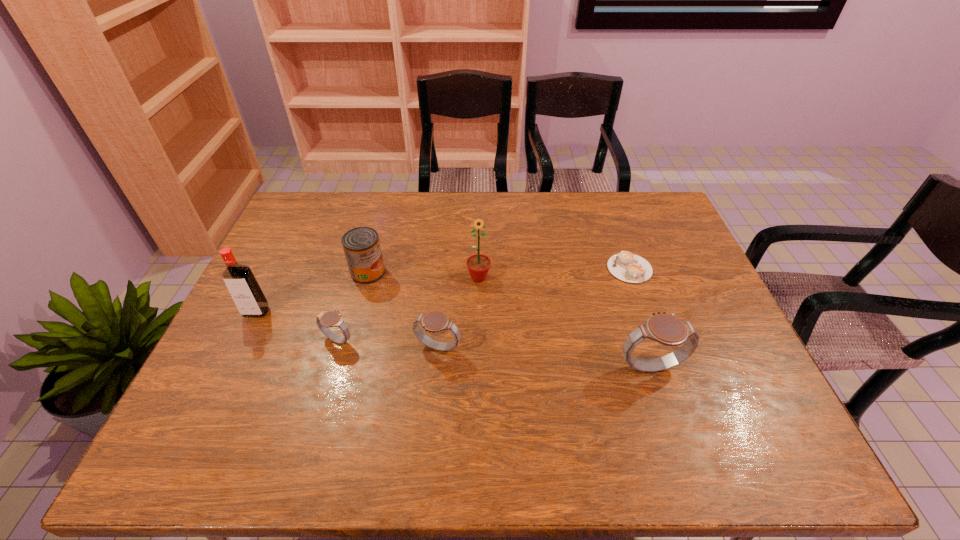
Locate an element on the screen. cappuccino that is at the right edge is located at coordinates (628, 267).

This screenshot has width=960, height=540. I want to click on object that is at the near right corner, so click(666, 329).

In the image, there is a desktop. Identify the location of vacant space at the far edge. The height and width of the screenshot is (540, 960). (448, 226).

Identify the location of vacant space at the near edge of the desktop. This screenshot has height=540, width=960. (279, 395).

Identify the location of vacant space at the left edge of the desktop. (273, 275).

In the image, there is a desktop. Where is `free space at the right edge`? Image resolution: width=960 pixels, height=540 pixels. free space at the right edge is located at coordinates (674, 282).

Locate an element on the screen. The width and height of the screenshot is (960, 540). vacant space at the far left corner of the desktop is located at coordinates (329, 200).

At what (x,y) coordinates should I click in order to perform the action: click on vacant area at the near left corner. Please return your answer as a coordinate pair (x, y). The width and height of the screenshot is (960, 540). Looking at the image, I should click on (209, 396).

The height and width of the screenshot is (540, 960). In order to click on vacant point located between the vodka and the fourth tallest object in this screenshot , I will do point(312,292).

Where is `vacant area between the third object from right to left and the fourth tallest object`? This screenshot has width=960, height=540. vacant area between the third object from right to left and the fourth tallest object is located at coordinates (423, 275).